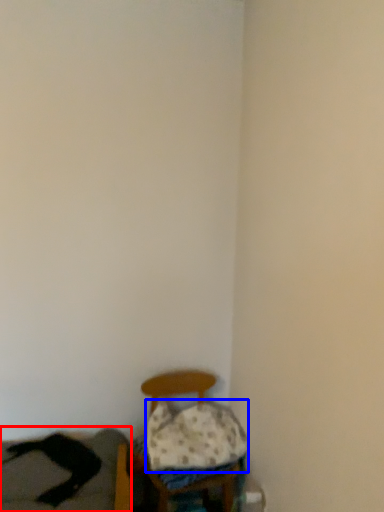
Question: Which object is further to the camera taking this photo, couch (highlighted by a red box) or pillow (highlighted by a blue box)?

Choices:
 (A) couch
 (B) pillow

Answer: (B)